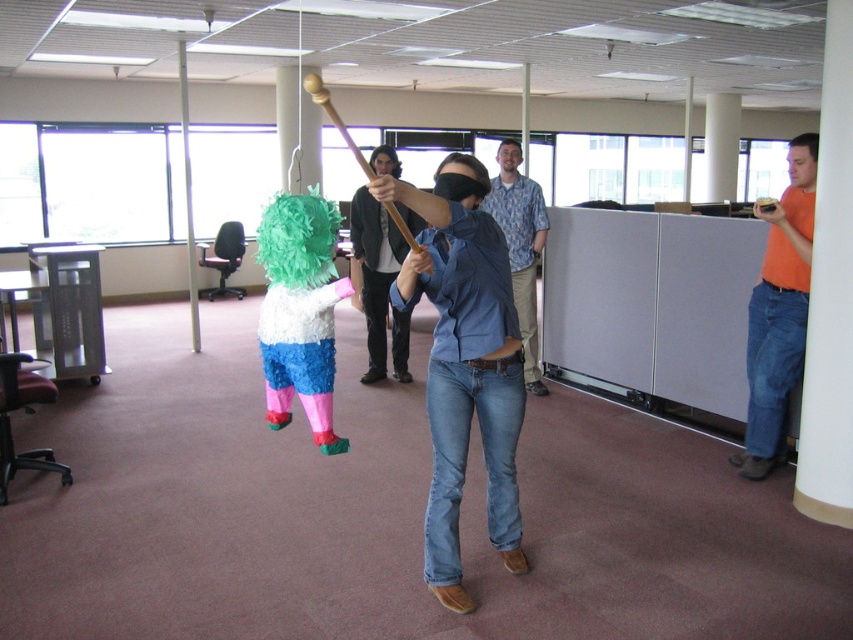
Question: Is orange cotton shirt at right in front of blue denim jeans at center?

Choices:
 (A) yes
 (B) no

Answer: (A)

Question: Based on their relative distances, which object is farther from the blue jeans at center?

Choices:
 (A) blue denim jeans at center
 (B) denim jeans at center

Answer: (B)

Question: Does orange cotton shirt at right have a larger size compared to blue denim jeans at center?

Choices:
 (A) yes
 (B) no

Answer: (B)

Question: Which of these objects is positioned farthest from the denim jeans at center?

Choices:
 (A) blue jeans at center
 (B) orange cotton shirt at right
 (C) blue denim jeans at center

Answer: (C)

Question: Is denim jeans at center to the left of orange cotton shirt at right from the viewer's perspective?

Choices:
 (A) yes
 (B) no

Answer: (A)

Question: Among these points, which one is nearest to the camera?

Choices:
 (A) (393, 330)
 (B) (759, 310)
 (C) (527, 388)
 (D) (474, 209)

Answer: (D)